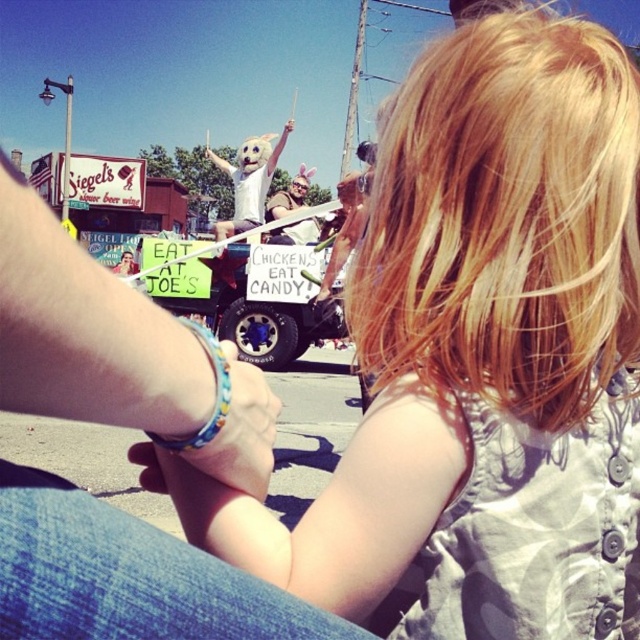
Question: Does blonde hair at upper center have a lesser width compared to matte brown leather jacket at center?

Choices:
 (A) yes
 (B) no

Answer: (A)

Question: Among these points, which one is nearest to the camera?

Choices:
 (A) (268, 202)
 (B) (248, 429)
 (C) (221, 355)

Answer: (C)

Question: Which object appears farthest from the camera in this image?

Choices:
 (A) multicolored beaded bracelet at lower center
 (B) matte brown leather jacket at center
 (C) blonde hair at upper center

Answer: (B)

Question: Which point is farther from the camera taking this photo?

Choices:
 (A) (280, 193)
 (B) (442, 253)
 (C) (214, 422)
 (D) (257, 472)

Answer: (A)

Question: Is multicolored beaded bracelet at lower center wider than matte brown leather jacket at center?

Choices:
 (A) no
 (B) yes

Answer: (A)

Question: Where is blonde hair at upper center located in relation to matte brown leather jacket at center in the image?

Choices:
 (A) below
 (B) above

Answer: (A)